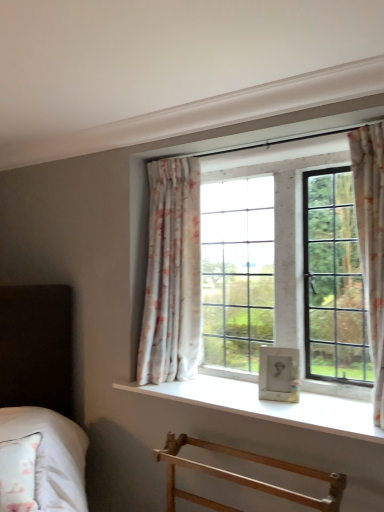
Describe the element at coordinates (41, 461) in the screenshot. I see `white soft fabric bed at lower left` at that location.

You are a GUI agent. You are given a task and a screenshot of the screen. Output one action in this format:
    pyautogui.click(x=<x>, y=<y>)
    Task: Click on the floral fabric curtain at right, positioned as the second curtain in left-to-right order
    This screenshot has width=384, height=512.
    Given the screenshot: What is the action you would take?
    pyautogui.click(x=371, y=242)

What do you see at coordinates (269, 405) in the screenshot? I see `white smooth window sill at center` at bounding box center [269, 405].

Find the location of `white smooth window sill at center`. white smooth window sill at center is located at coordinates (269, 405).

Where is `light wood towel rack at lower center`? light wood towel rack at lower center is located at coordinates (243, 476).

Describe the element at coordinates (172, 275) in the screenshot. I see `floral fabric curtain at upper center, positioned as the 1th curtain in back-to-front order` at that location.

I want to click on white soft fabric bed at lower left, so click(41, 461).

I want to click on bed above the light wood towel rack at lower center (from a real-world perspective), so click(x=41, y=461).

Which object is wider, light wood towel rack at lower center or white soft fabric bed at lower left?

Wider between the two is white soft fabric bed at lower left.

Does light wood towel rack at lower center turn towards white soft fabric bed at lower left?

No, light wood towel rack at lower center is not facing towards white soft fabric bed at lower left.

How much distance is there between light wood towel rack at lower center and white soft fabric bed at lower left?

light wood towel rack at lower center and white soft fabric bed at lower left are 24.65 inches apart.

Considering the relative positions of white soft fabric bed at lower left and floral fabric curtain at upper center, positioned as the first curtain in left-to-right order, in the image provided, is white soft fabric bed at lower left to the left or to the right of floral fabric curtain at upper center, positioned as the first curtain in left-to-right order,?

In the image, white soft fabric bed at lower left appears on the left side of floral fabric curtain at upper center, positioned as the first curtain in left-to-right order.

Which is behind, white soft fabric bed at lower left or floral fabric curtain at upper center, which is the 2th curtain in right-to-left order?

floral fabric curtain at upper center, which is the 2th curtain in right-to-left order, is further away from the camera.

Would you say white soft fabric bed at lower left is outside floral fabric curtain at upper center, positioned as the 1th curtain in back-to-front order?

Absolutely, white soft fabric bed at lower left is external to floral fabric curtain at upper center, positioned as the 1th curtain in back-to-front order.

Which is behind, point (196, 501) or point (182, 158)?

The point (182, 158) is farther from the camera.

Which is behind, light wood towel rack at lower center or floral fabric curtain at upper center, positioned as the first curtain in left-to-right order?

floral fabric curtain at upper center, positioned as the first curtain in left-to-right order.

Could you tell me if light wood towel rack at lower center is turned towards floral fabric curtain at upper center, which is the 2th curtain in right-to-left order?

No.

Considering the sizes of white soft fabric bed at lower left and light wood towel rack at lower center in the image, is white soft fabric bed at lower left wider or thinner than light wood towel rack at lower center?

Clearly, white soft fabric bed at lower left has more width compared to light wood towel rack at lower center.

From the image's perspective, is white soft fabric bed at lower left on top of light wood towel rack at lower center?

Indeed, from the image's perspective, white soft fabric bed at lower left is shown above light wood towel rack at lower center.

Is the position of white soft fabric bed at lower left more distant than that of light wood towel rack at lower center?

Yes, white soft fabric bed at lower left is further from the camera.

Is white smooth window sill at center positioned with its back to floral fabric curtain at right, which ranks as the first curtain in right-to-left order?

No, white smooth window sill at center's orientation is not away from floral fabric curtain at right, which ranks as the first curtain in right-to-left order.

Considering the points (192, 383) and (374, 242), which point is in front, point (192, 383) or point (374, 242)?

The point (374, 242) is closer.

Could you measure the distance between white smooth window sill at center and floral fabric curtain at right, the 1th curtain from the front?

white smooth window sill at center is 23.84 inches from floral fabric curtain at right, the 1th curtain from the front.

In the image, there is a floral fabric curtain at right, which ranks as the first curtain in right-to-left order. What are the coordinates of `bed below it (from the image's perspective)` in the screenshot? It's located at pyautogui.click(x=41, y=461).

Is white soft fabric bed at lower left next to floral fabric curtain at right, the 1th curtain from the front?

No, white soft fabric bed at lower left is not in contact with floral fabric curtain at right, the 1th curtain from the front.

Which object is positioned more to the left, white soft fabric bed at lower left or floral fabric curtain at right, which ranks as the first curtain in right-to-left order?

white soft fabric bed at lower left is more to the left.

From the image's perspective, between white soft fabric bed at lower left and floral fabric curtain at right, the 1th curtain from the front, which one is located above?

floral fabric curtain at right, the 1th curtain from the front, is shown above in the image.

Could you measure the distance between floral fabric curtain at right, which ranks as the first curtain in right-to-left order, and white smooth window sill at center?

floral fabric curtain at right, which ranks as the first curtain in right-to-left order, and white smooth window sill at center are 60.56 centimeters apart from each other.

Is floral fabric curtain at right, the 1th curtain from the front, next to white smooth window sill at center?

A: No, floral fabric curtain at right, the 1th curtain from the front, is not making contact with white smooth window sill at center.

In the scene shown: Can you confirm if floral fabric curtain at right, positioned as the second curtain in left-to-right order, is smaller than white smooth window sill at center?

Incorrect, floral fabric curtain at right, positioned as the second curtain in left-to-right order, is not smaller in size than white smooth window sill at center.

From the image's perspective, who appears lower, floral fabric curtain at right, positioned as the second curtain in left-to-right order, or white smooth window sill at center?

white smooth window sill at center.

Locate an element on the screen. furniture below the white soft fabric bed at lower left (from a real-world perspective) is located at coordinates (243, 476).

From the image's perspective, count 1st curtains upward from the white soft fabric bed at lower left and point to it. Please provide its 2D coordinates.

[(172, 275)]

Which object lies nearer to the anchor point white smooth window sill at center, floral fabric curtain at right, positioned as the second curtain in left-to-right order, or light wood towel rack at lower center?

light wood towel rack at lower center is closer to white smooth window sill at center.

From the image, which object appears to be farther from floral fabric curtain at right, the 2th curtain in the back-to-front sequence, white soft fabric bed at lower left or white smooth window sill at center?

white soft fabric bed at lower left is further to floral fabric curtain at right, the 2th curtain in the back-to-front sequence.

From the image, which object appears to be farther from light wood towel rack at lower center, white soft fabric bed at lower left or white smooth window sill at center?

white soft fabric bed at lower left is further to light wood towel rack at lower center.

Looking at the image, which one is located further to white smooth window sill at center, white soft fabric bed at lower left or floral fabric curtain at right, the 2th curtain in the back-to-front sequence?

white soft fabric bed at lower left lies further to white smooth window sill at center than the other object.

From the image, which object appears to be farther from light wood towel rack at lower center, floral fabric curtain at upper center, positioned as the 1th curtain in back-to-front order, or floral fabric curtain at right, positioned as the second curtain in left-to-right order?

Among the two, floral fabric curtain at right, positioned as the second curtain in left-to-right order, is located further to light wood towel rack at lower center.

Looking at the image, which one is located further to floral fabric curtain at right, which ranks as the first curtain in right-to-left order, floral fabric curtain at upper center, positioned as the 1th curtain in back-to-front order, or light wood towel rack at lower center?

The object further to floral fabric curtain at right, which ranks as the first curtain in right-to-left order, is floral fabric curtain at upper center, positioned as the 1th curtain in back-to-front order.

Looking at the image, which one is located closer to light wood towel rack at lower center, white smooth window sill at center or floral fabric curtain at right, which ranks as the first curtain in right-to-left order?

white smooth window sill at center is positioned closer to the anchor light wood towel rack at lower center.

Looking at the image, which one is located closer to white soft fabric bed at lower left, floral fabric curtain at upper center, placed as the second curtain when sorted from front to back, or white smooth window sill at center?

The object closer to white soft fabric bed at lower left is white smooth window sill at center.

The height and width of the screenshot is (512, 384). I want to click on curtain between floral fabric curtain at right, positioned as the second curtain in left-to-right order, and light wood towel rack at lower center, in the vertical direction, so click(172, 275).

The image size is (384, 512). In order to click on furniture located between white soft fabric bed at lower left and floral fabric curtain at right, positioned as the second curtain in left-to-right order, in the left-right direction in this screenshot , I will do [x=243, y=476].

Locate an element on the screen. curtain between white soft fabric bed at lower left and floral fabric curtain at right, the 1th curtain from the front is located at coordinates (172, 275).

I want to click on window sill between white soft fabric bed at lower left and floral fabric curtain at right, the 2th curtain in the back-to-front sequence, so click(269, 405).